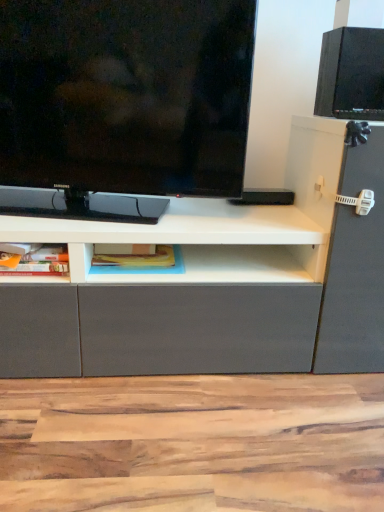
Question: Looking at the image, does blue matte bookshelf at center, acting as the 2th cabinet starting from the left, seem bigger or smaller compared to black matte speaker at upper right?

Choices:
 (A) small
 (B) big

Answer: (A)

Question: From the image's perspective, relative to black matte speaker at upper right, is blue matte bookshelf at center, the first cabinet positioned from the right, above or below?

Choices:
 (A) above
 (B) below

Answer: (B)

Question: Which of these objects is positioned farthest from the matte plastic container at lower left, which is the second cabinet from right to left?

Choices:
 (A) blue matte bookshelf at center, acting as the 2th cabinet starting from the left
 (B) matte black tv at upper left
 (C) black matte speaker at upper right

Answer: (C)

Question: Which is farther from the blue matte bookshelf at center, acting as the 2th cabinet starting from the left?

Choices:
 (A) black matte speaker at upper right
 (B) matte plastic container at lower left, which is the second cabinet from right to left
 (C) matte black tv at upper left

Answer: (A)